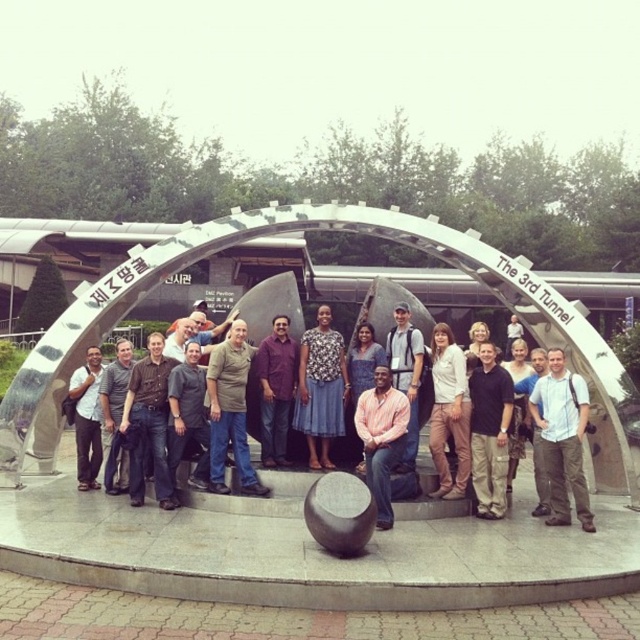
Does brown leather shirt at center have a lesser height compared to matte black jacket at center?

Incorrect, brown leather shirt at center's height does not fall short of matte black jacket at center's.

Can you confirm if brown leather shirt at center is positioned above matte black jacket at center?

Correct, brown leather shirt at center is located above matte black jacket at center.

Is point (148, 348) in front of point (129, 364)?

No, it is not.

In order to click on brown leather shirt at center in this screenshot , I will do `click(148, 422)`.

Is denim jacket at center below matte white shirt at center?

Correct, denim jacket at center is located below matte white shirt at center.

Which is more to the left, denim jacket at center or matte white shirt at center?

matte white shirt at center is more to the left.

Between point (461, 417) and point (92, 444), which one is positioned in front?

Point (461, 417) is more forward.

The image size is (640, 640). Identify the location of denim jacket at center. (449, 412).

Is denim jacket at center further to camera compared to purple shirt at center?

No, denim jacket at center is closer to the viewer.

Is point (458, 449) farther from camera compared to point (280, 371)?

No, (458, 449) is in front of (280, 371).

I want to click on denim jacket at center, so click(x=449, y=412).